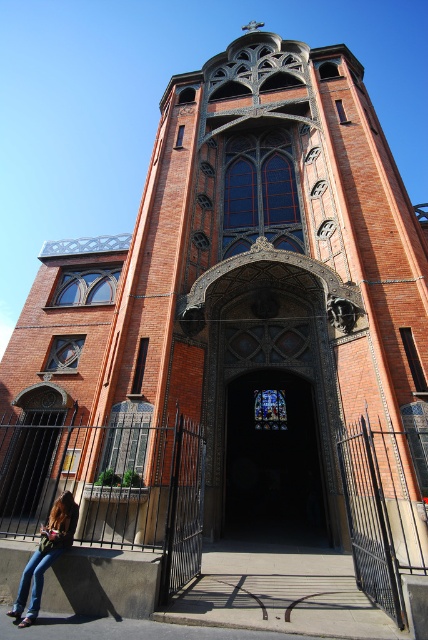
Consider the image. Between dark stained glass door at center and denim jeans at lower left, which one is positioned higher?

denim jeans at lower left is higher up.

Which is in front, point (262, 500) or point (70, 492)?

Point (70, 492) is in front.

You are a GUI agent. You are given a task and a screenshot of the screen. Output one action in this format:
    pyautogui.click(x=<x>, y=<y>)
    Task: Click on the dark stained glass door at center
    Image resolution: width=428 pixels, height=640 pixels.
    Given the screenshot: What is the action you would take?
    pyautogui.click(x=273, y=461)

In the scene shown: Does dark stained glass door at center come behind smooth concrete ledge at lower left?

Yes, it is.

Between point (308, 433) and point (98, 595), which one is positioned in front?

Point (98, 595)

The width and height of the screenshot is (428, 640). What do you see at coordinates (273, 461) in the screenshot?
I see `dark stained glass door at center` at bounding box center [273, 461].

This screenshot has height=640, width=428. Find the location of `dark stained glass door at center`. dark stained glass door at center is located at coordinates pyautogui.click(x=273, y=461).

In the scene shown: Who is positioned more to the right, smooth concrete ledge at lower left or denim jeans at lower left?

From the viewer's perspective, smooth concrete ledge at lower left appears more on the right side.

Between point (89, 604) and point (38, 572), which one is positioned in front?

Point (38, 572)

This screenshot has width=428, height=640. I want to click on smooth concrete ledge at lower left, so click(x=103, y=582).